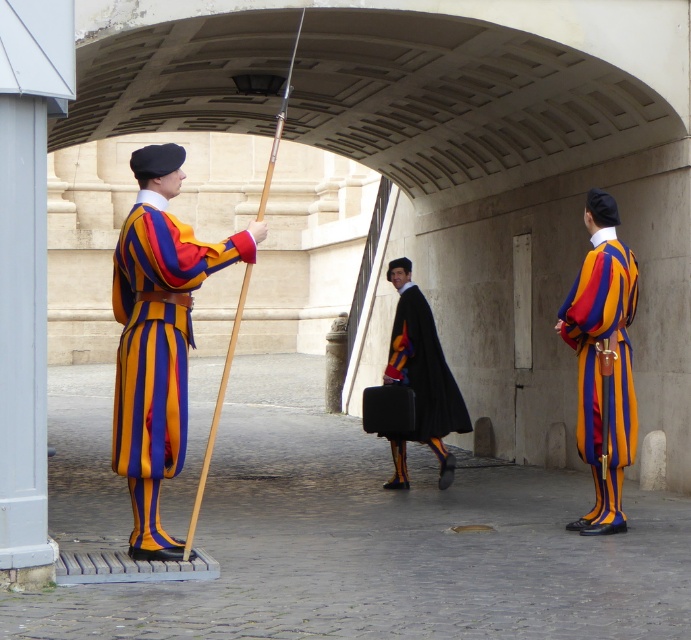
In the scene shown: Is striped wool uniform at center behind striped wool coat at right?

No.

Is point (249, 257) in front of point (594, 369)?

Yes, point (249, 257) is closer to viewer.

The image size is (691, 640). What do you see at coordinates (155, 349) in the screenshot?
I see `striped wool uniform at center` at bounding box center [155, 349].

This screenshot has width=691, height=640. Identify the location of striped wool uniform at center. (155, 349).

Which is behind, point (580, 292) or point (397, 365)?

The point (397, 365) is more distant.

I want to click on striped wool coat at right, so click(x=600, y=371).

Between point (585, 316) and point (446, 420), which one is positioned behind?

Point (446, 420)

Identify the location of striped wool coat at right. The image size is (691, 640). (600, 371).

Between striped wool uniform at center and black velvet cape at center, which one appears on the right side from the viewer's perspective?

From the viewer's perspective, black velvet cape at center appears more on the right side.

Does striped wool uniform at center have a greater width compared to black velvet cape at center?

No.

Is point (169, 237) positioned behind point (408, 280)?

No, it is not.

The height and width of the screenshot is (640, 691). I want to click on striped wool uniform at center, so click(155, 349).